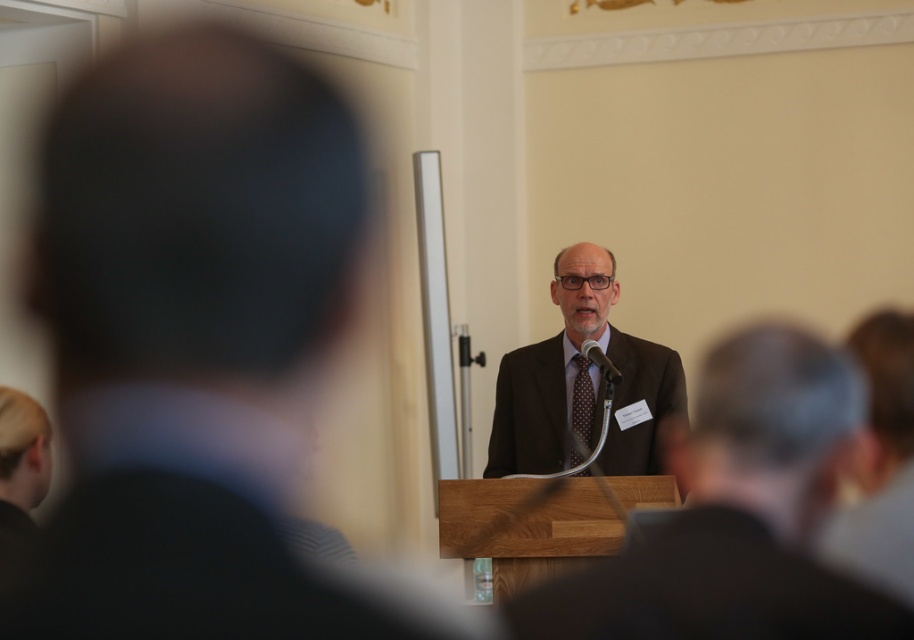
You are a photographer at the event and want to capture a clear photo of the speaker. The speaker is wearing two layers of clothing visible in the image. Which layer of clothing, the brown suit at center or the brown textured suit at center, is positioned higher on the speaker?

The brown suit at center is positioned higher than the brown textured suit at center, so the brown suit at center is the layer that appears higher on the speaker.

You are standing in the audience looking at the speaker. Where is the matte brown suit at center located in relation to the point marked at coordinates (737,515)?

The point at coordinates (737,515) corresponds to the matte brown suit at center, so they are in the same location.

You are a photographer positioned at the camera. You need to adjust your lens to focus on the dark brown fabric business suit at center. What is the minimum distance you should set your lens focus to ensure the suit is in clear view?

The dark brown fabric business suit at center and camera are 37.46 inches apart from each other. Therefore, the minimum focus distance should be set to 37.46 inches to ensure the suit is in clear view.